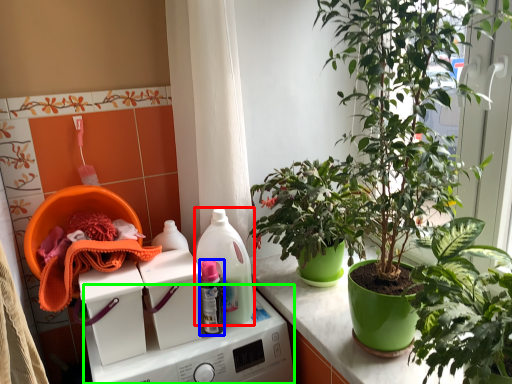
Question: Which object is positioned farthest from cleaning product (highlighted by a red box)? Select from bottle (highlighted by a blue box) and washing machine (highlighted by a green box).

Choices:
 (A) bottle
 (B) washing machine

Answer: (B)